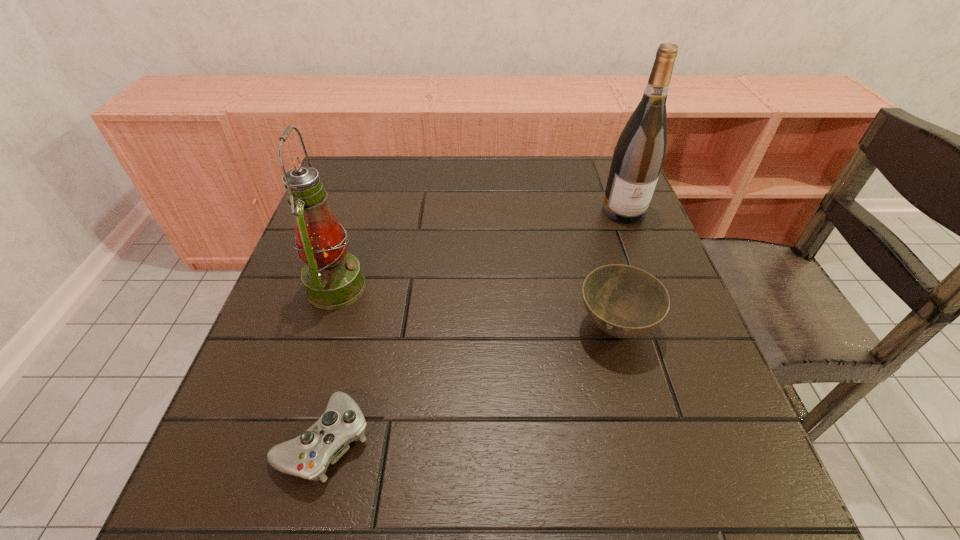
This screenshot has height=540, width=960. I want to click on free area in between the oil lamp and the bowl, so click(x=475, y=307).

Identify the location of free space between the oil lamp and the control. (330, 364).

Locate an element on the screen. free spot between the wine bottle and the oil lamp is located at coordinates (480, 249).

Locate an element on the screen. Image resolution: width=960 pixels, height=540 pixels. object identified as the closest to the bowl is located at coordinates (639, 154).

Where is `object that is the second closest to the control`? object that is the second closest to the control is located at coordinates pyautogui.click(x=624, y=301).

Image resolution: width=960 pixels, height=540 pixels. I want to click on blank area in the image that satisfies the following two spatial constraints: 1. on the front side of the third tallest object; 2. on the left side of the oil lamp, so click(x=324, y=327).